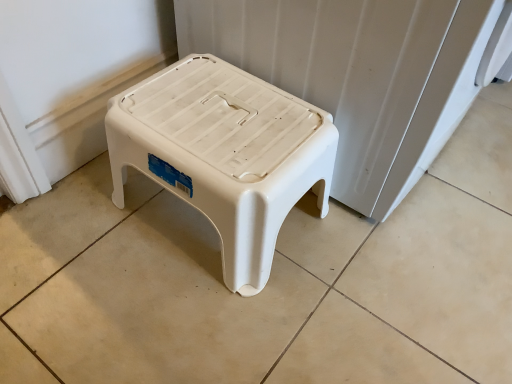
Identify the location of vacant region above white plastic stool at center (from a real-world perspective). (220, 118).